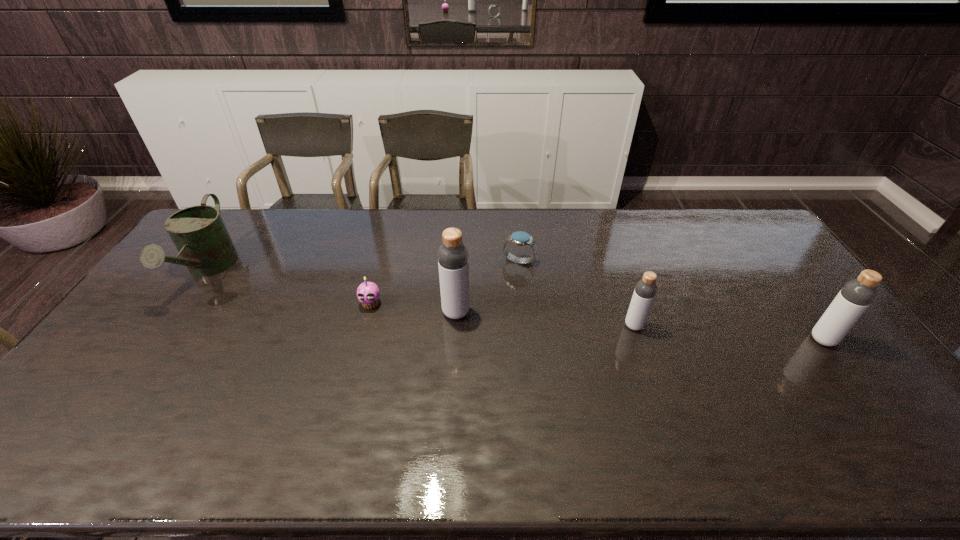
You are a GUI agent. You are given a task and a screenshot of the screen. Output one action in this format:
    pyautogui.click(x=<x>, y=<y>)
    Task: Click on the vacant space located 0.200m on the right of the second bottle from left to right
    The height and width of the screenshot is (540, 960).
    Given the screenshot: What is the action you would take?
    pyautogui.click(x=711, y=326)

The width and height of the screenshot is (960, 540). What are the coordinates of `vacant space situated 0.210m on the front of the second tallest bottle` in the screenshot? It's located at click(880, 417).

Locate an element on the screen. vacant space located with the spout on the watering can is located at coordinates (124, 391).

Locate an element on the screen. vacant space situated on the front of the watch is located at coordinates (524, 313).

Where is `free space located 0.260m on the face of the cupcake`? free space located 0.260m on the face of the cupcake is located at coordinates (349, 384).

Identify the location of object present at the far edge. This screenshot has height=540, width=960. (198, 232).

I want to click on object that is at the left edge, so click(x=198, y=232).

Locate an element on the screen. object at the right edge is located at coordinates (855, 297).

Locate an element on the screen. The height and width of the screenshot is (540, 960). object at the far left corner is located at coordinates (198, 232).

Identify the location of vacant area at the far edge of the desktop. (662, 243).